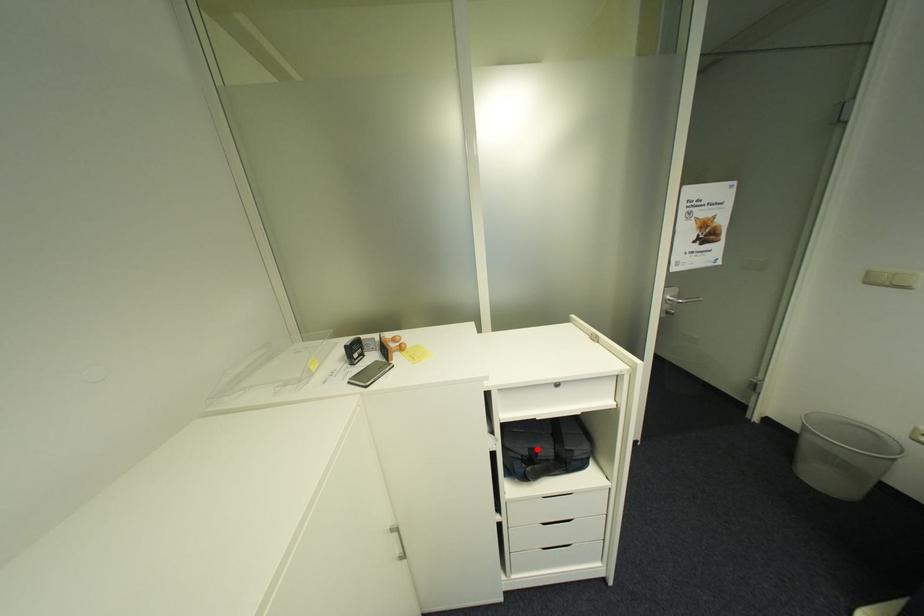
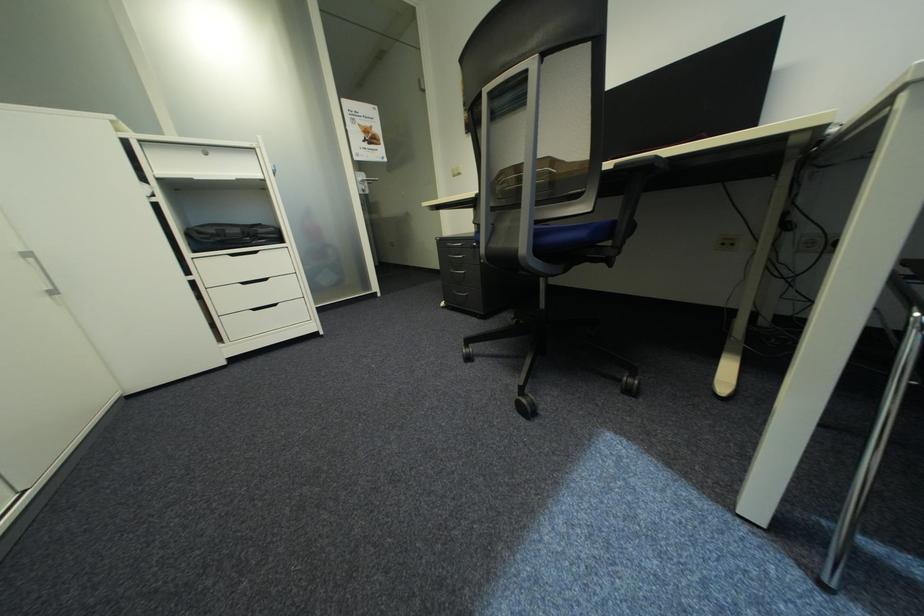
Question: I am providing you with two images of the same scene from different viewpoints. A red point is shown in image1. For the corresponding object point in image2, is it positioned nearer or farther from the camera?

Choices:
 (A) Nearer
 (B) Farther

Answer: (A)